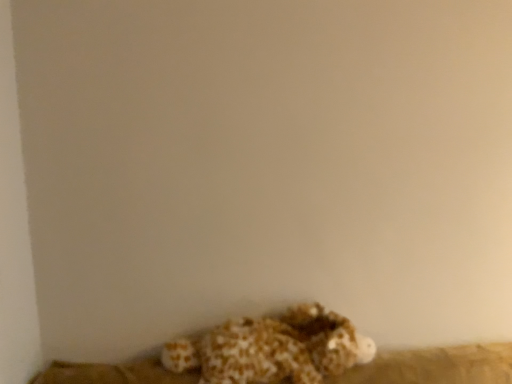
Where is `fluffy brown stuffed animal at lower center`? The width and height of the screenshot is (512, 384). fluffy brown stuffed animal at lower center is located at coordinates (272, 348).

Measure the distance between fluffy brown stuffed animal at lower center and camera.

fluffy brown stuffed animal at lower center and camera are 1.41 meters apart.

In order to face fluffy brown stuffed animal at lower center, should I rotate leftwards or rightwards?

You should rotate right by 2.435 degrees.

What do you see at coordinates (272, 348) in the screenshot?
I see `fluffy brown stuffed animal at lower center` at bounding box center [272, 348].

Find the location of a particular element. Image resolution: width=512 pixels, height=384 pixels. fluffy brown stuffed animal at lower center is located at coordinates (272, 348).